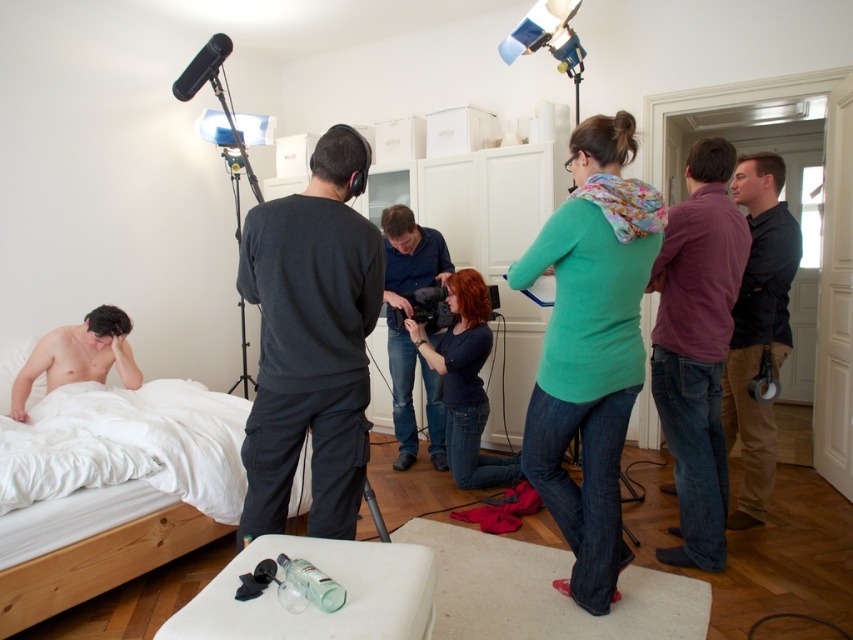
You are standing at the origin point in the room. The white wood bed at lower left is located at coordinates 0.881, 0.117. If you want to walk directly to the bed, which direction should you move?

Since the white wood bed at lower left is located at coordinates (99, 563), you should move towards the lower left direction to reach it.

You are a photographer setting up a shoot in the bedroom scene. You need to position a large equipment bag that is 1.5 meters wide. Can the white wood bed at lower left or the blue jeans at center accommodate this bag without overlapping other objects?

The blue jeans at center is larger than the white wood bed at lower left. Since the equipment bag is 1.5 meters wide, the blue jeans at center might be able to accommodate it if there is enough space, but the white wood bed at lower left is too small. However, without knowing the exact dimensions of the objects, it is uncertain. Please check the available space carefully.